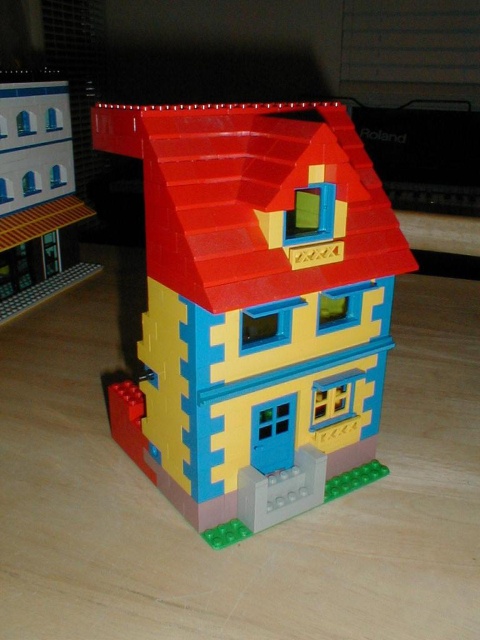
You are a tiny LEGO figure standing at the base of the LEGO house. You see two points marked in the image. Which point is closer to you, point [320,296] or point [22,230]?

Point [320,296] is closer to the viewer than point [22,230], so the tiny LEGO figure would perceive point [320,296] as closer.